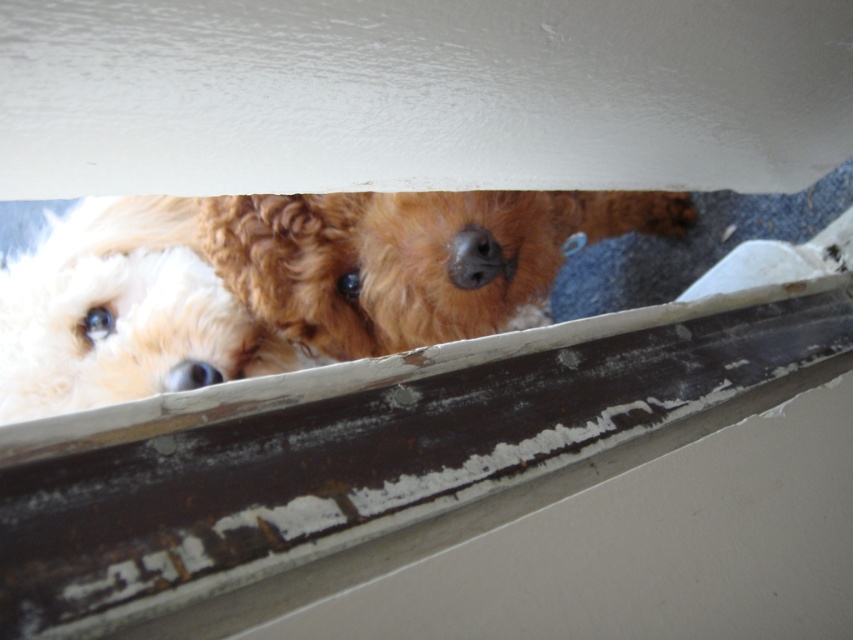
Question: Is rusty metal window sill at lower center thinner than matte brown nose at center?

Choices:
 (A) yes
 (B) no

Answer: (B)

Question: Based on their relative distances, which object is nearer to the matte brown nose at center?

Choices:
 (A) rusty metal window sill at lower center
 (B) curly golden fur at center
 (C) white fluffy dog at left

Answer: (B)

Question: Where is rusty metal window sill at lower center located in relation to curly golden fur at center in the image?

Choices:
 (A) above
 (B) below

Answer: (B)

Question: Considering the real-world distances, which object is closest to the curly golden fur at center?

Choices:
 (A) matte brown nose at center
 (B) white fluffy dog at left

Answer: (A)

Question: Is white fluffy dog at left to the right of matte brown nose at center from the viewer's perspective?

Choices:
 (A) yes
 (B) no

Answer: (B)

Question: Among these objects, which one is farthest from the camera?

Choices:
 (A) curly golden fur at center
 (B) matte brown nose at center

Answer: (A)